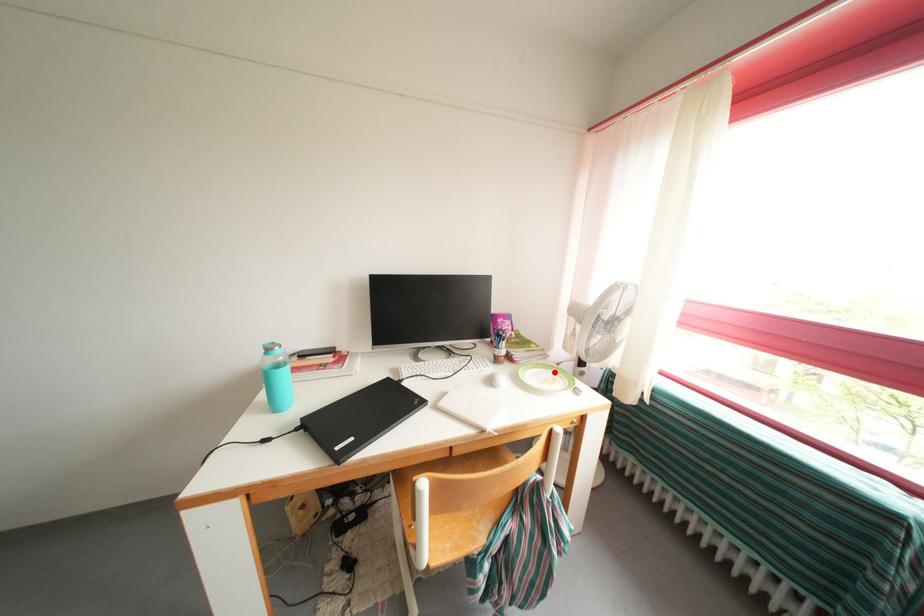
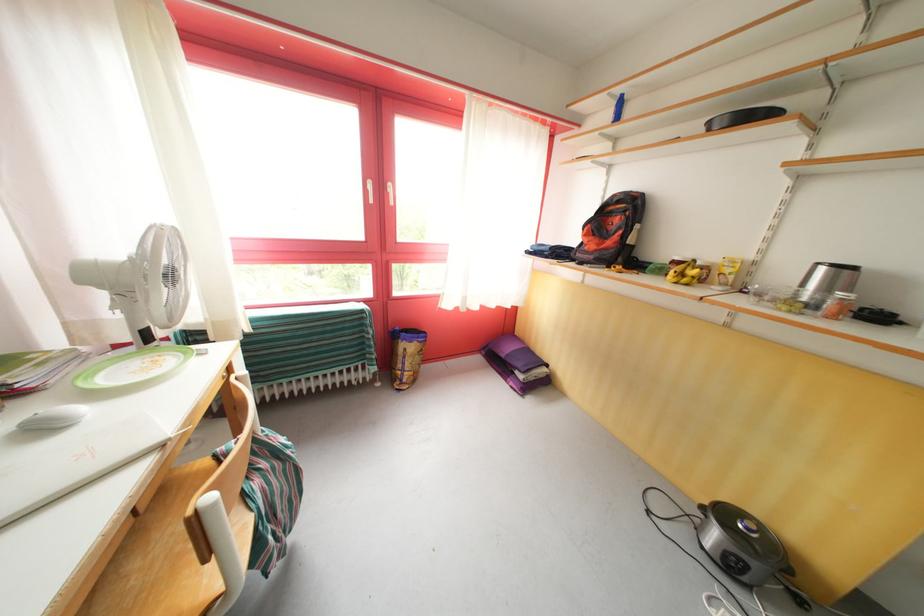
In the second image, find the point that corresponds to the highlighted location in the first image.

(128, 363)